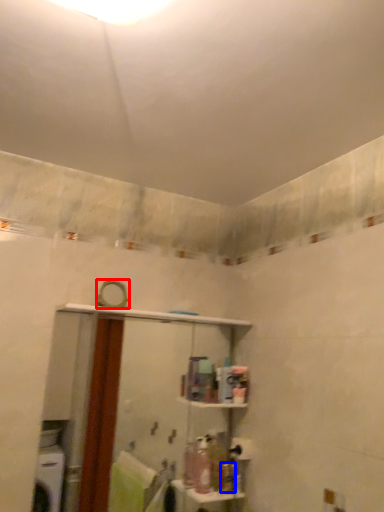
Question: Among these objects, which one is farthest to the camera, mirror (highlighted by a red box) or toiletry (highlighted by a blue box)?

Choices:
 (A) mirror
 (B) toiletry

Answer: (B)